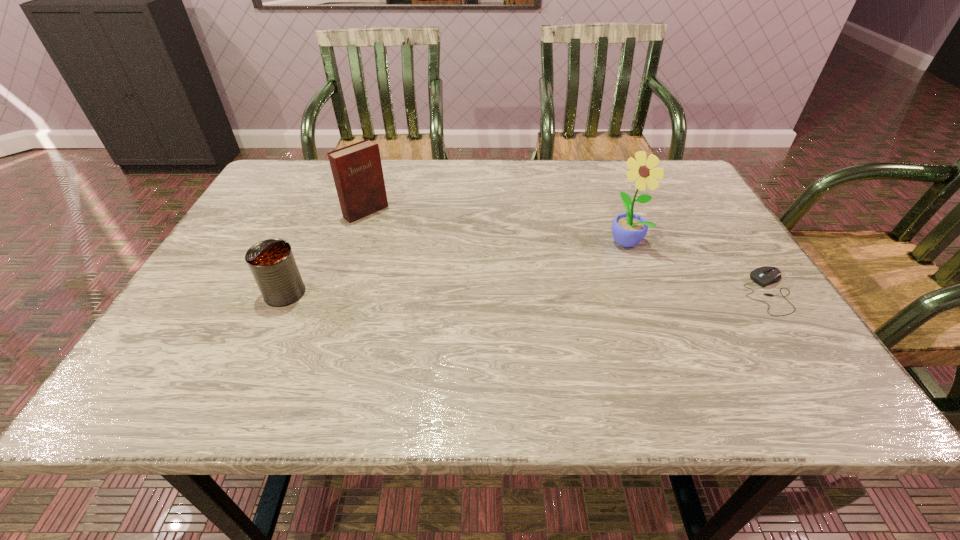
Locate an element on the screen. Image resolution: width=960 pixels, height=540 pixels. free spot on the desktop that is between the can and the shortest object and is positioned on the front-facing side of the tallest object is located at coordinates (558, 293).

Find the location of a particular element. Image resolution: width=960 pixels, height=540 pixels. free space on the desktop that is between the can and the computer mouse and is positioned on the front cover of the farthest object is located at coordinates (465, 293).